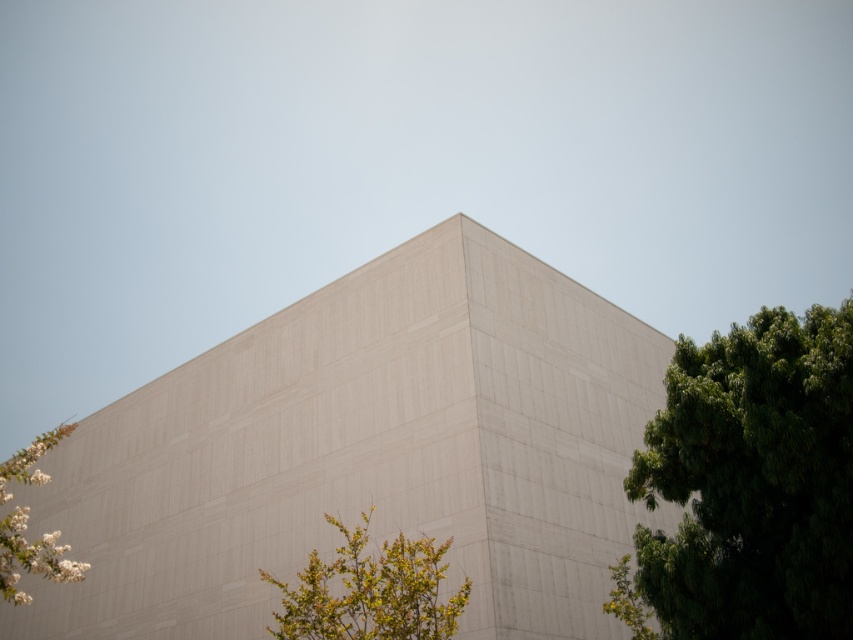
Can you confirm if green leafy bush at lower center is bigger than white textured flowers at lower left?

Incorrect, green leafy bush at lower center is not larger than white textured flowers at lower left.

Can you confirm if green leafy bush at lower center is taller than white textured flowers at lower left?

In fact, green leafy bush at lower center may be shorter than white textured flowers at lower left.

What do you see at coordinates (370, 592) in the screenshot?
I see `green leafy bush at lower center` at bounding box center [370, 592].

The image size is (853, 640). In order to click on green leafy bush at lower center in this screenshot , I will do `click(370, 592)`.

The height and width of the screenshot is (640, 853). In order to click on green leafy tree at right in this screenshot , I will do `click(752, 483)`.

Is point (728, 593) positioned after point (39, 477)?

No, it is in front of (39, 477).

Image resolution: width=853 pixels, height=640 pixels. In order to click on green leafy tree at right in this screenshot , I will do `click(752, 483)`.

Looking at this image, is green leafy tree at right thinner than green leafy bush at lower center?

Yes.

Is point (759, 508) farther from camera compared to point (358, 556)?

No, (759, 508) is closer to viewer.

At what (x,y) coordinates should I click in order to perform the action: click on green leafy tree at right. Please return your answer as a coordinate pair (x, y). The image size is (853, 640). Looking at the image, I should click on (752, 483).